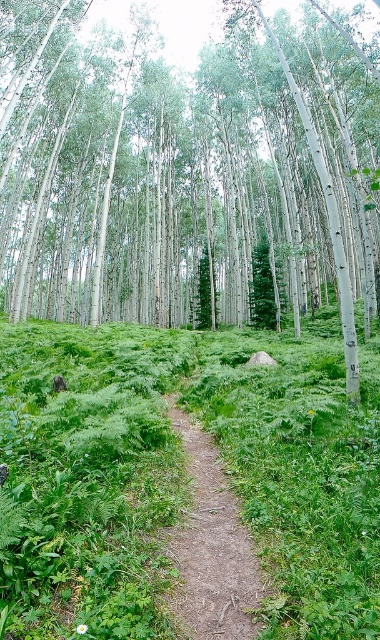
You are a hiker who wants to walk along the dirt path at center without stepping on the green leafy grass at center. Based on the scene description, can you do so easily?

The green leafy grass at center is much taller than the dirt path at center, so it might be challenging to walk along the dirt path at center without stepping on the grass since the grass is taller and possibly encroaching on the path.

You are a hiker walking along the narrow dirt path in the forest. You notice a white smooth tree at center and green leafy grass at center. Which object is positioned to the left when facing the direction of the path?

The white smooth tree at center is to the left of green leafy grass at center, so when facing the direction of the path, the white smooth tree at center is positioned to the left.